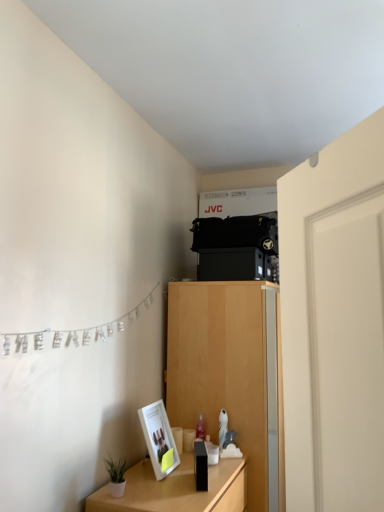
This screenshot has width=384, height=512. In order to click on free location above silver metallic banner at left (from a real-world perspective) in this screenshot , I will do `click(91, 269)`.